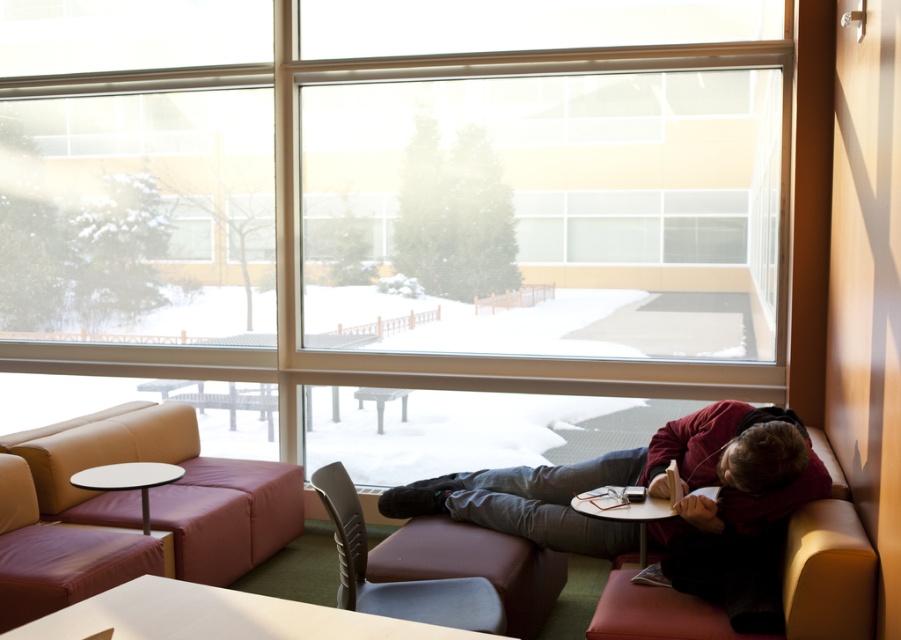
Question: Which of the following is the farthest from the observer?

Choices:
 (A) (35, 632)
 (B) (661, 595)
 (C) (589, 536)
 (D) (126, 461)

Answer: (D)

Question: Is maroon fleece jacket at lower right below wooden smooth table at lower center?

Choices:
 (A) yes
 (B) no

Answer: (A)

Question: Estimate the real-world distances between objects in this image. Which object is farther from the maroon leather couch at lower right?

Choices:
 (A) transparent glass window at center
 (B) gray fabric chair at center
 (C) matte black table at lower left
 (D) maroon fleece jacket at lower right

Answer: (A)

Question: Which point is closer to the camera?

Choices:
 (A) gray fabric chair at center
 (B) transparent glass window at center
 (C) maroon fleece jacket at lower right

Answer: (A)

Question: Is the position of maroon fleece jacket at lower right less distant than that of white glossy table at lower center?

Choices:
 (A) no
 (B) yes

Answer: (A)

Question: Can you confirm if maroon leather couch at lower right is smaller than matte black table at lower left?

Choices:
 (A) yes
 (B) no

Answer: (B)